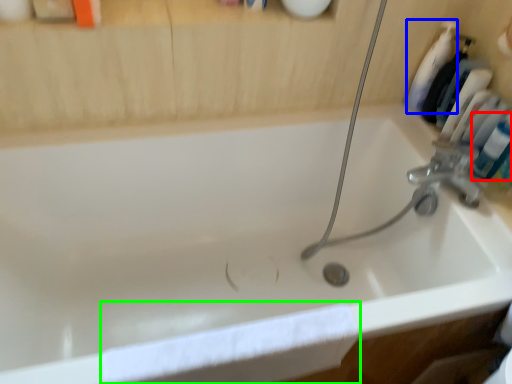
Question: Which object is positioned closest to mouthwash (highlighted by a red box)? Select from cleaning product (highlighted by a blue box) and bath towel (highlighted by a green box).

Choices:
 (A) cleaning product
 (B) bath towel

Answer: (A)